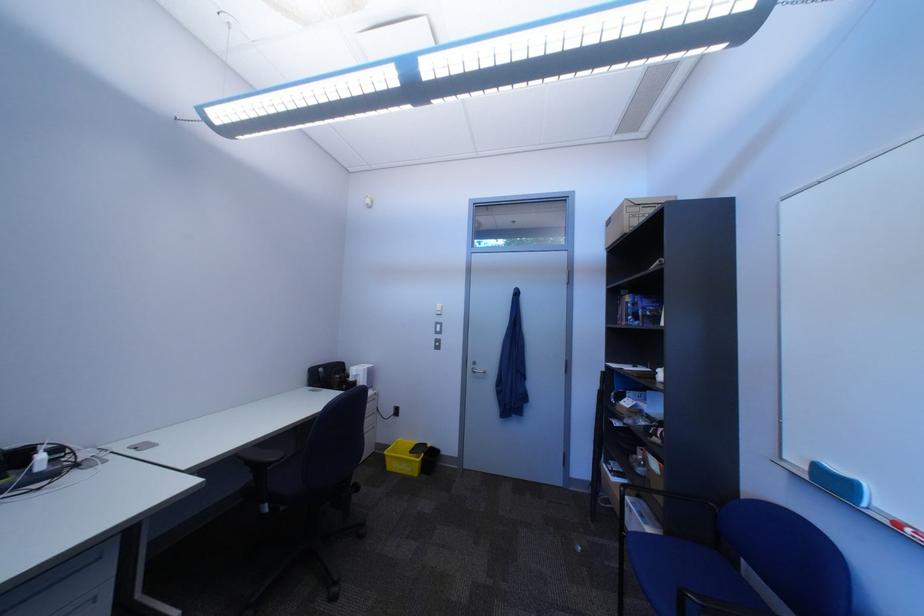
I want to click on yellow plastic bin, so click(405, 456).